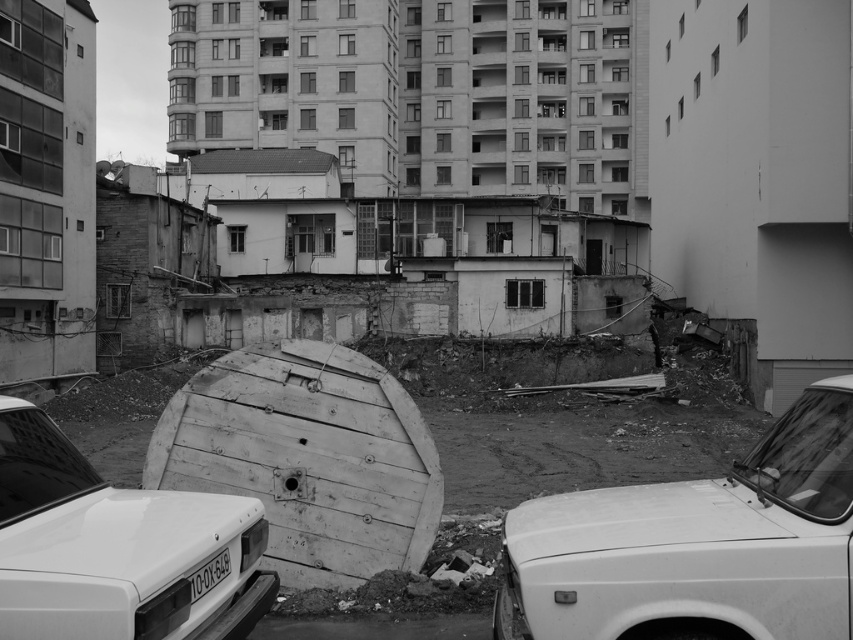
Question: Can you confirm if wooden barrel at center is positioned to the left of white matte car at center?

Choices:
 (A) no
 (B) yes

Answer: (A)

Question: Where is wooden barrel at center located in relation to white plastic license plate at lower center in the image?

Choices:
 (A) below
 (B) above

Answer: (B)

Question: Which object appears farthest from the camera in this image?

Choices:
 (A) white plastic license plate at lower center
 (B) white matte car at lower right

Answer: (A)

Question: Which point appears closest to the camera in this image?

Choices:
 (A) (360, 486)
 (B) (199, 596)
 (C) (114, 598)

Answer: (C)

Question: Which object is the farthest from the white matte car at center?

Choices:
 (A) wooden barrel at center
 (B) white matte car at lower right

Answer: (A)

Question: Is white matte car at lower right further to the viewer compared to white matte car at center?

Choices:
 (A) yes
 (B) no

Answer: (A)